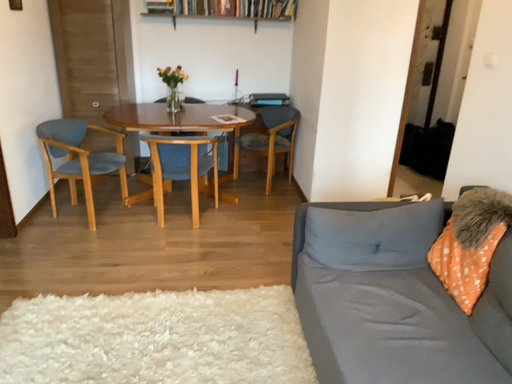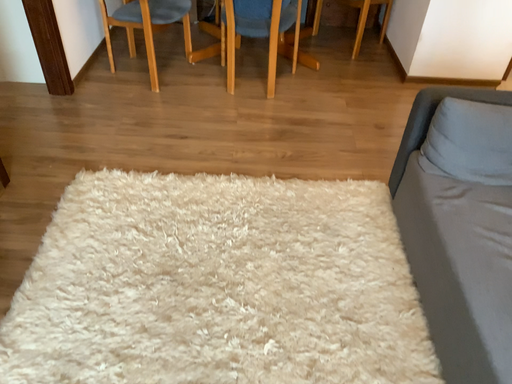
Question: Which way did the camera rotate in the video?

Choices:
 (A) rotated upward
 (B) rotated downward

Answer: (B)